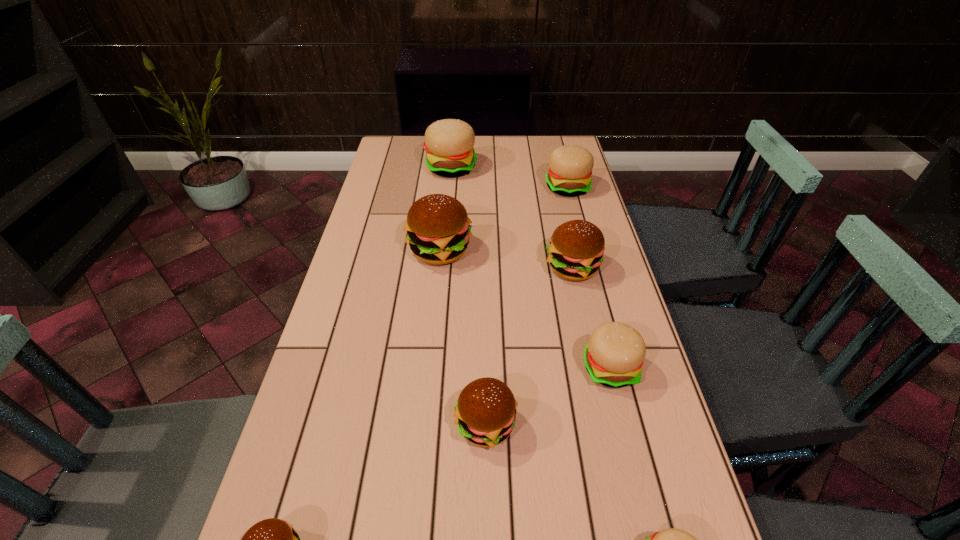
Identify the location of the biggest brown hamburger. This screenshot has width=960, height=540. (438, 228).

Where is `the biggest beige hamburger`? the biggest beige hamburger is located at coordinates (449, 143).

Locate an element on the screen. The image size is (960, 540). the rightmost brown hamburger is located at coordinates (575, 252).

This screenshot has height=540, width=960. Identify the location of the third smallest beige hamburger. (570, 167).

Where is `the second nearest brown hamburger`? The height and width of the screenshot is (540, 960). the second nearest brown hamburger is located at coordinates (485, 412).

The width and height of the screenshot is (960, 540). Find the location of `the sixth farthest hamburger`. the sixth farthest hamburger is located at coordinates (485, 412).

This screenshot has width=960, height=540. Find the location of `the fourth nearest object`. the fourth nearest object is located at coordinates (614, 355).

I want to click on the second nearest beige hamburger, so click(x=614, y=355).

At what (x,y) coordinates should I click in order to perform the action: click on vacant space located on the back of the biggest brown hamburger. Please return your answer as a coordinate pair (x, y). The width and height of the screenshot is (960, 540). Looking at the image, I should click on (445, 200).

What are the coordinates of `free space located 0.080m on the left of the biggest beige hamburger` in the screenshot? It's located at (404, 167).